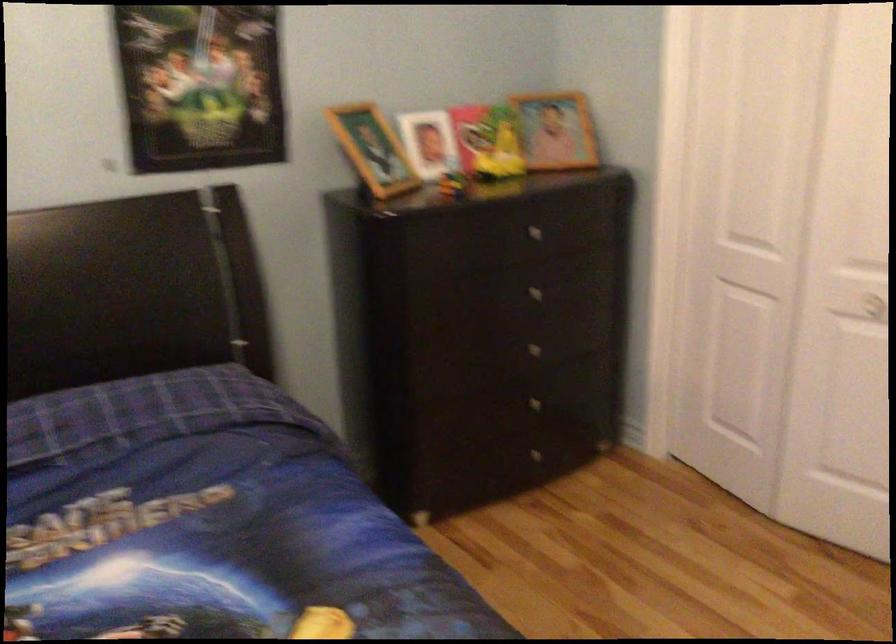
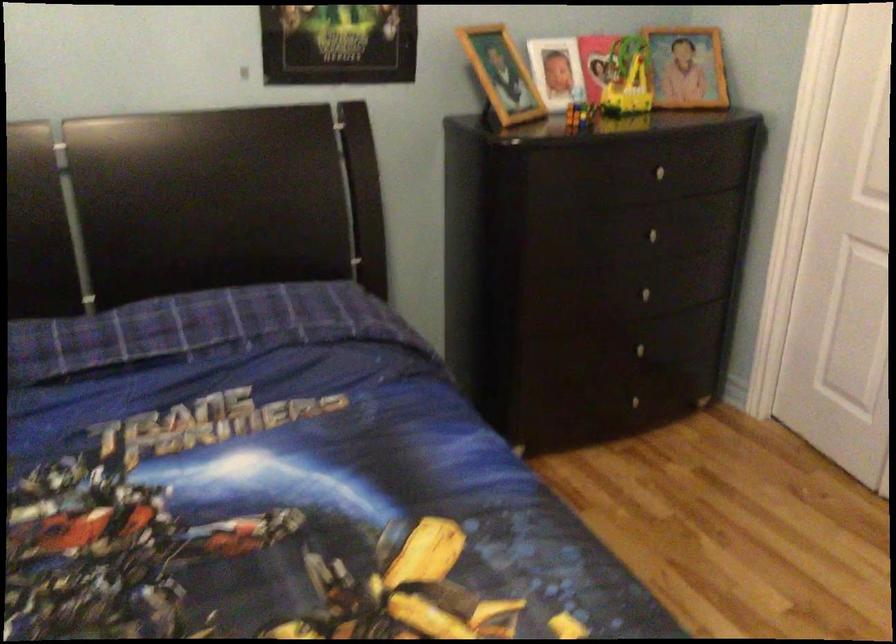
Question: Based on the continuous images, in which direction is the camera rotating? Reply with the corresponding letter.

Choices:
 (A) Left
 (B) Right
 (C) Up
 (D) Down

Answer: (A)